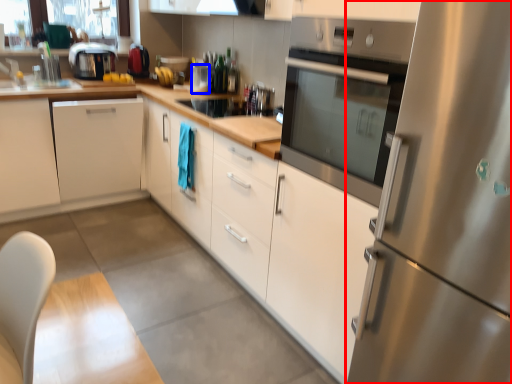
Question: Among these objects, which one is nearest to the camera, refrigerator (highlighted by a red box) or appliance (highlighted by a blue box)?

Choices:
 (A) refrigerator
 (B) appliance

Answer: (A)